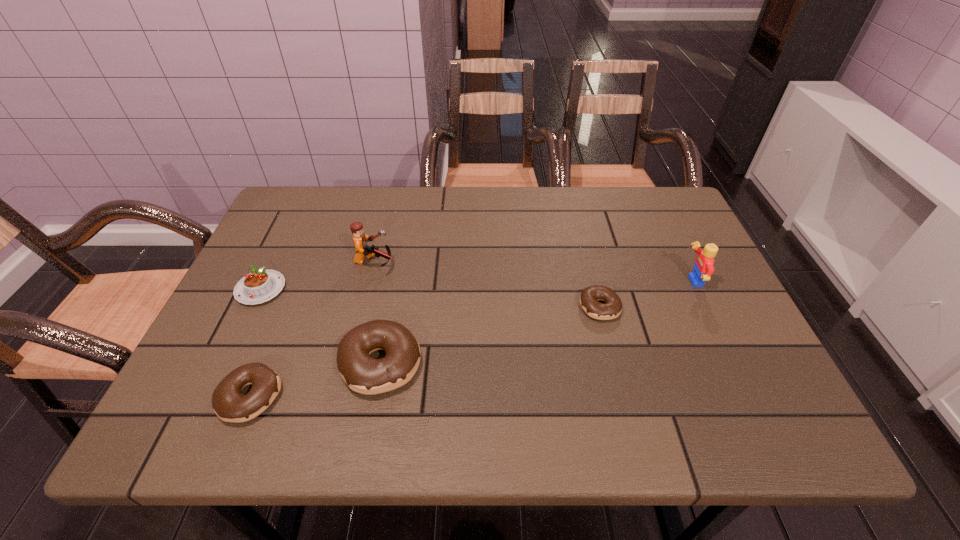
Locate an element on the screen. This screenshot has height=540, width=960. vacant space located on the left of the rightmost doughnut is located at coordinates (423, 307).

I want to click on free space located on the back of the pudding, so click(x=282, y=244).

Where is `blank space located 0.240m holding a crossbow in the hands of the left Lego`? Image resolution: width=960 pixels, height=540 pixels. blank space located 0.240m holding a crossbow in the hands of the left Lego is located at coordinates (486, 262).

Image resolution: width=960 pixels, height=540 pixels. I want to click on free space located on the face of the rightmost object, so click(x=658, y=282).

Find the location of a particular element. This screenshot has width=960, height=540. vacant space situated on the face of the rightmost object is located at coordinates (566, 282).

At what (x,y) coordinates should I click in order to perform the action: click on vacant space positioned on the face of the rightmost object. Please return your answer as a coordinate pair (x, y). Looking at the image, I should click on (606, 282).

Find the location of a particular element. doughnut at the left edge is located at coordinates (230, 405).

The image size is (960, 540). Identify the location of pudding at the left edge. (259, 286).

You are a GUI agent. You are given a task and a screenshot of the screen. Output one action in this format:
    pyautogui.click(x=<x>, y=<y>)
    Task: Click on the object that is at the right edge
    
    Given the screenshot: What is the action you would take?
    pyautogui.click(x=703, y=269)

The height and width of the screenshot is (540, 960). Find the location of `object situated at the near left corner`. object situated at the near left corner is located at coordinates (230, 405).